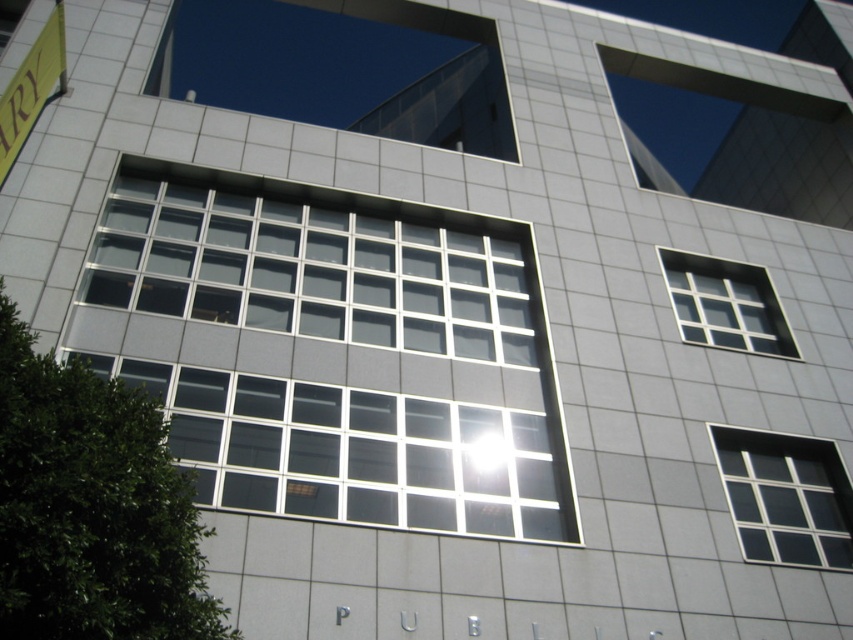
Does clear glass window at center appear under clear glass window at center right?

Incorrect, clear glass window at center is not positioned below clear glass window at center right.

Who is more forward, (560,538) or (770,516)?

Point (560,538) is in front.

Who is more forward, (199, 426) or (793, 490)?

Point (199, 426) is in front.

The height and width of the screenshot is (640, 853). Find the location of `clear glass window at center`. clear glass window at center is located at coordinates (338, 349).

Is clear glass window at center right bigger than clear glass window at upper right?

Indeed, clear glass window at center right has a larger size compared to clear glass window at upper right.

Identify the location of clear glass window at center right. (786, 497).

In order to click on clear glass window at center right in this screenshot , I will do `click(786, 497)`.

From the picture: Can you confirm if clear glass window at center is positioned to the left of clear glass window at upper right?

Indeed, clear glass window at center is positioned on the left side of clear glass window at upper right.

From the picture: Is clear glass window at center in front of clear glass window at upper right?

That is True.

Image resolution: width=853 pixels, height=640 pixels. I want to click on clear glass window at center, so click(338, 349).

Locate an element on the screen. Image resolution: width=853 pixels, height=640 pixels. clear glass window at center is located at coordinates (338, 349).